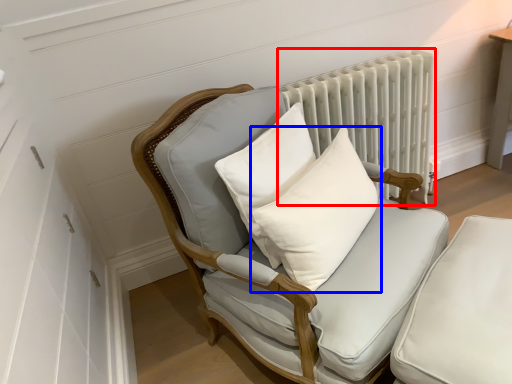
Question: Which object is further to the camera taking this photo, radiator (highlighted by a red box) or pillow (highlighted by a blue box)?

Choices:
 (A) radiator
 (B) pillow

Answer: (A)